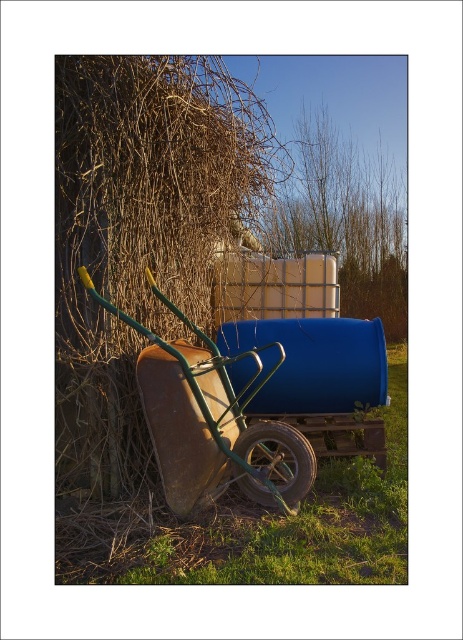
Question: Among these objects, which one is nearest to the camera?

Choices:
 (A) rusty metal cart at left
 (B) green grass at lower center

Answer: (B)

Question: Can you confirm if green grass at lower center is positioned above rusty metal cart at left?

Choices:
 (A) no
 (B) yes

Answer: (A)

Question: Which of the following is the closest to the observer?

Choices:
 (A) (81, 570)
 (B) (238, 432)

Answer: (A)

Question: Can you confirm if green grass at lower center is thinner than rusty metal cart at left?

Choices:
 (A) yes
 (B) no

Answer: (B)

Question: Is green grass at lower center below rusty metal cart at left?

Choices:
 (A) yes
 (B) no

Answer: (A)

Question: Which object appears closest to the camera in this image?

Choices:
 (A) rusty metal cart at left
 (B) green grass at lower center

Answer: (B)